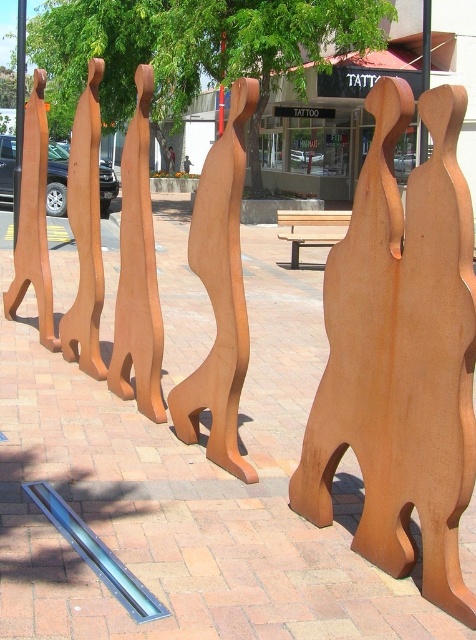
Between point (208, 294) and point (171, 157), which one is positioned in front?

Point (208, 294) is more forward.

Is brown wood sculpture at center positioned in front of wooden sculpture at center?

That is True.

Which is behind, point (234, 237) or point (168, 161)?

The point (168, 161) is more distant.

You are a GUI agent. You are given a task and a screenshot of the screen. Output one action in this format:
    pyautogui.click(x=<x>, y=<y>)
    Task: Click on the brown wood sculpture at center
    Image resolution: width=476 pixels, height=640 pixels.
    Given the screenshot: What is the action you would take?
    pyautogui.click(x=219, y=292)

Does wooden sculpture at center have a lesser height compared to brown wooden sculpture at center?

No.

Identify the location of wooden sculpture at center. This screenshot has height=640, width=476. (169, 160).

Is point (171, 156) farther from camera compared to point (188, 173)?

Yes, point (171, 156) is farther from viewer.

Image resolution: width=476 pixels, height=640 pixels. What are the coordinates of `wooden sculpture at center` in the screenshot? It's located at (169, 160).

Does rusty metal sculpture at center come in front of brown wooden sculpture at center?

Yes, rusty metal sculpture at center is closer to the viewer.

Who is more forward, (427, 518) or (191, 164)?

Point (427, 518) is more forward.

Who is more distant from viewer, (x=353, y=307) or (x=186, y=163)?

The point (x=186, y=163) is more distant.

Locate an element on the screen. The width and height of the screenshot is (476, 640). rusty metal sculpture at center is located at coordinates (400, 355).